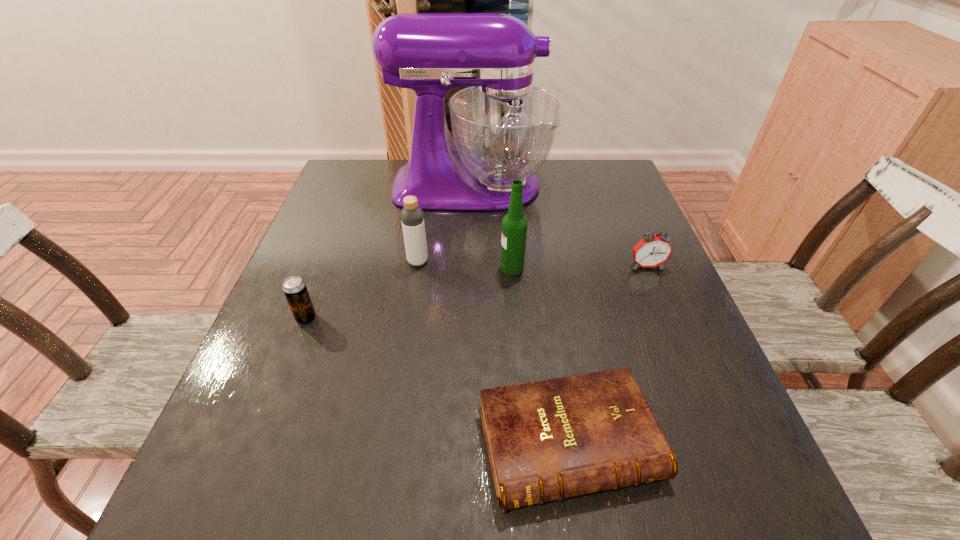
Locate an element on the screen. This screenshot has height=540, width=960. the farthest object is located at coordinates point(503,127).

The width and height of the screenshot is (960, 540). Identify the location of mixer. (503, 127).

This screenshot has height=540, width=960. Identify the location of the fifth shortest object. (514, 225).

Locate an element on the screen. This screenshot has width=960, height=540. bottle is located at coordinates [412, 217].

This screenshot has height=540, width=960. What are the coordinates of `the rightmost object` in the screenshot? It's located at (651, 251).

Where is `the leftmost object`? The image size is (960, 540). the leftmost object is located at coordinates (294, 288).

This screenshot has width=960, height=540. I want to click on beer can, so pos(294,288).

Locate an element on the screen. the nearest object is located at coordinates (551, 439).

Identify the location of the shortest object. The image size is (960, 540). (551, 439).

What are the coordinates of `blank space located 0.200m at the bowl opening of the farthest object` in the screenshot? It's located at (620, 186).